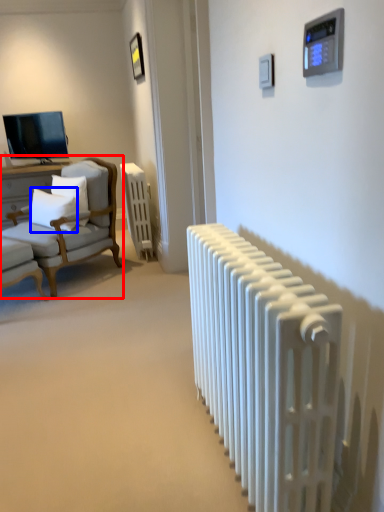
Question: Among these objects, which one is nearest to the camera, chair (highlighted by a red box) or pillow (highlighted by a blue box)?

Choices:
 (A) chair
 (B) pillow

Answer: (A)